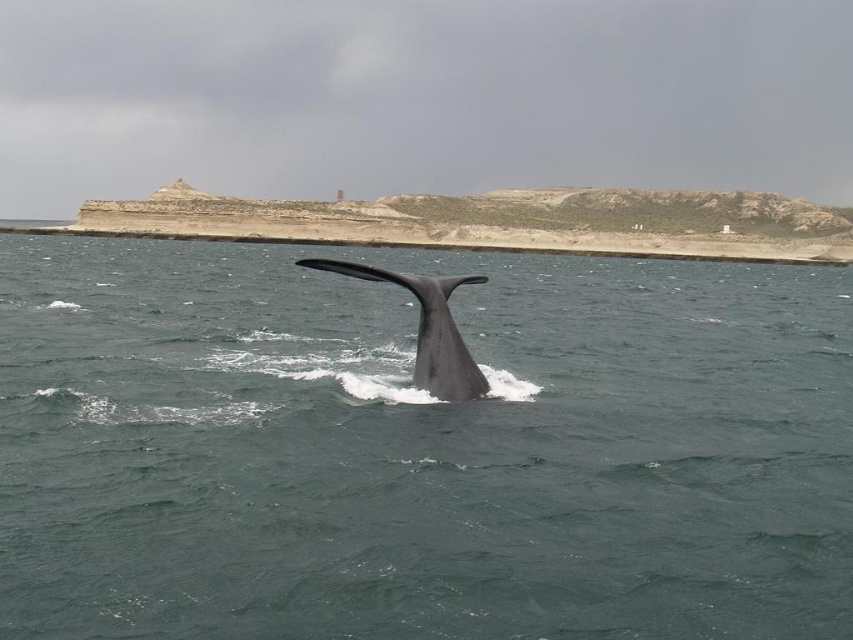
You are a marine biologist studying the whale in the image. You need to determine the location of the dark blue water at center relative to the whale. Is it directly above or below the whale?

The dark blue water at center is located at point (419,449), which is directly below the whale since the whale is positioned centrally in the frame with its tail emerging from the water.